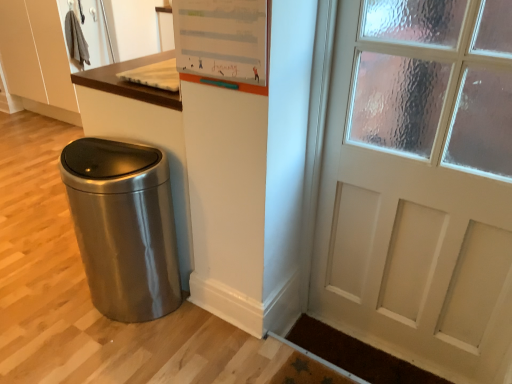
Question: Is satin metallic trash can at lower left in front of or behind brown textured mat at lower right in the image?

Choices:
 (A) behind
 (B) front

Answer: (B)

Question: Would you say satin metallic trash can at lower left is inside or outside brown textured mat at lower right?

Choices:
 (A) outside
 (B) inside

Answer: (A)

Question: Estimate the real-world distances between objects in this image. Which object is farther from the white matte dry erase board at upper center?

Choices:
 (A) satin metallic trash can at lower left
 (B) brown textured mat at lower right

Answer: (B)

Question: Estimate the real-world distances between objects in this image. Which object is farther from the brown textured mat at lower right?

Choices:
 (A) white matte dry erase board at upper center
 (B) satin metallic trash can at lower left

Answer: (A)